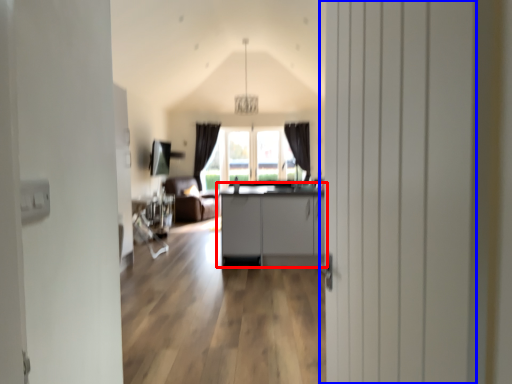
Question: Which of the following is the closest to the observer, cabinetry (highlighted by a red box) or door (highlighted by a blue box)?

Choices:
 (A) cabinetry
 (B) door

Answer: (B)